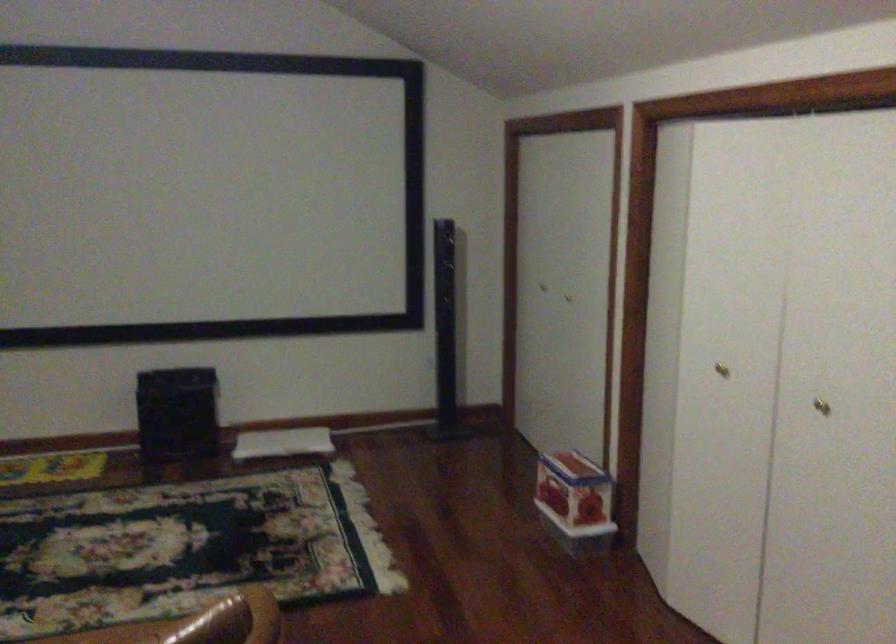
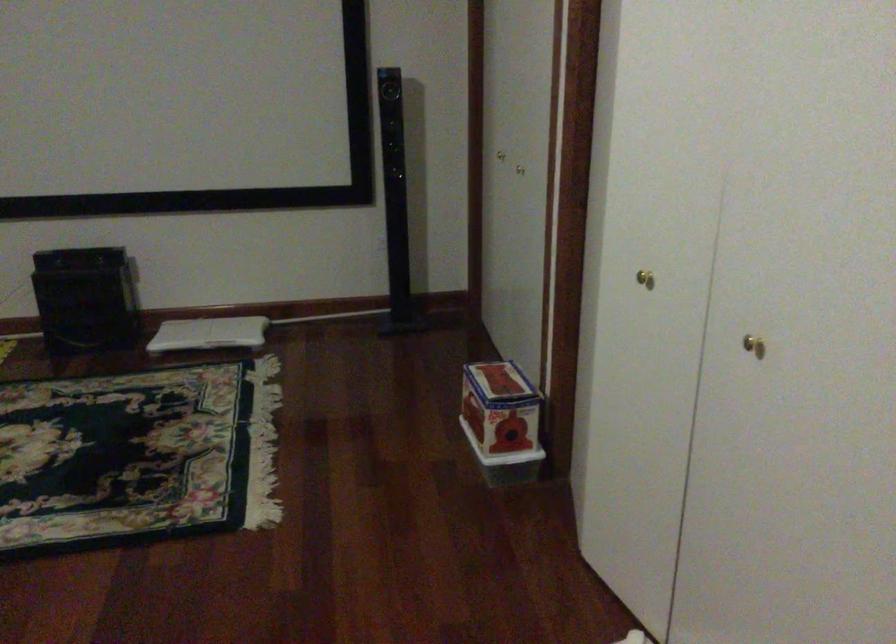
In the second image, find the point that corresponds to (x=287, y=444) in the first image.

(209, 333)